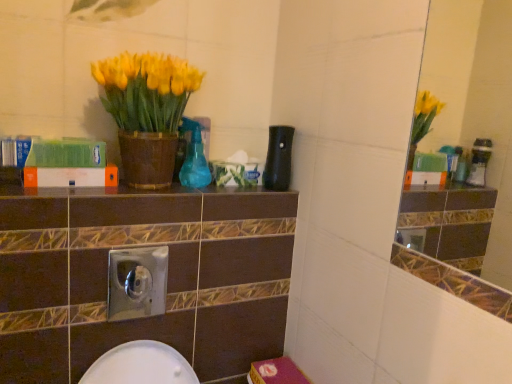
Question: Is green matte book at upper left, acting as the 1th book starting from the top, inside or outside of brown glossy ledge at center?

Choices:
 (A) inside
 (B) outside

Answer: (B)

Question: In terms of size, does green matte book at upper left, acting as the 1th book starting from the top, appear bigger or smaller than brown glossy ledge at center?

Choices:
 (A) small
 (B) big

Answer: (B)

Question: Which is nearer to the brown glossy ledge at center?

Choices:
 (A) white matte book at center, the 1th book positioned from the bottom
 (B) yellow matte vase at upper left
 (C) green matte book at upper left, arranged as the 2th book when ordered from the bottom

Answer: (A)

Question: Estimate the real-world distances between objects in this image. Which object is closer to the white matte book at center, the 1th book positioned from the bottom?

Choices:
 (A) green matte book at upper left, acting as the 1th book starting from the top
 (B) brown glossy ledge at center
 (C) yellow matte vase at upper left

Answer: (A)